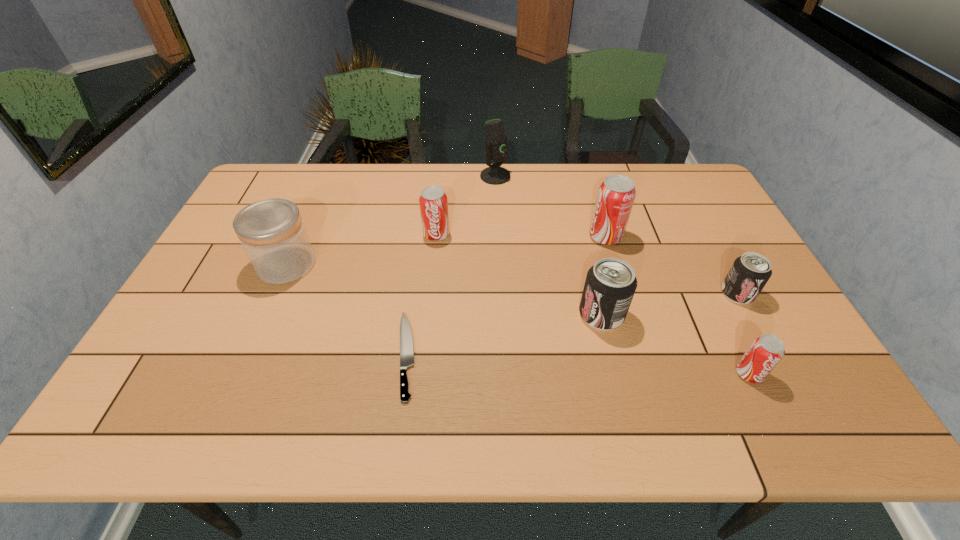
Locate which object is the closest to the fifth object from right to left. Please provide its 2D coordinates. Your answer should be formatted as a tuple, i.e. [(x, y)], where the tuple contains the x and y coordinates of a point satisfying the conditions above.

[(433, 201)]

Find the location of a particular element. The image size is (960, 540). soda can that can be found as the closest to the shortest object is located at coordinates click(433, 201).

At what (x,y) coordinates should I click in order to perform the action: click on soda can that is the closest to the bigger black soda can. Please return your answer as a coordinate pair (x, y). The width and height of the screenshot is (960, 540). Looking at the image, I should click on (616, 194).

You are a GUI agent. You are given a task and a screenshot of the screen. Output one action in this format:
    pyautogui.click(x=<x>, y=<y>)
    Task: Click on the red soda can that is the second closest one to the leftmost soda can
    The width and height of the screenshot is (960, 540).
    Given the screenshot: What is the action you would take?
    pyautogui.click(x=766, y=351)

Select which red soda can is the third closest to the smaller black soda can. Please provide its 2D coordinates. Your answer should be formatted as a tuple, i.e. [(x, y)], where the tuple contains the x and y coordinates of a point satisfying the conditions above.

[(433, 201)]

Locate an element on the screen. The image size is (960, 540). vacant space that satisfies the following two spatial constraints: 1. on the logo side of the leftmost soda can; 2. on the left side of the right black soda can is located at coordinates point(430,293).

I want to click on vacant space that satisfies the following two spatial constraints: 1. on the front side of the farthest object; 2. on the left side of the left black soda can, so click(501, 314).

Locate an element on the screen. The height and width of the screenshot is (540, 960). free point that satisfies the following two spatial constraints: 1. on the logo side of the second red soda can from left to right; 2. on the front side of the shortest object is located at coordinates (641, 355).